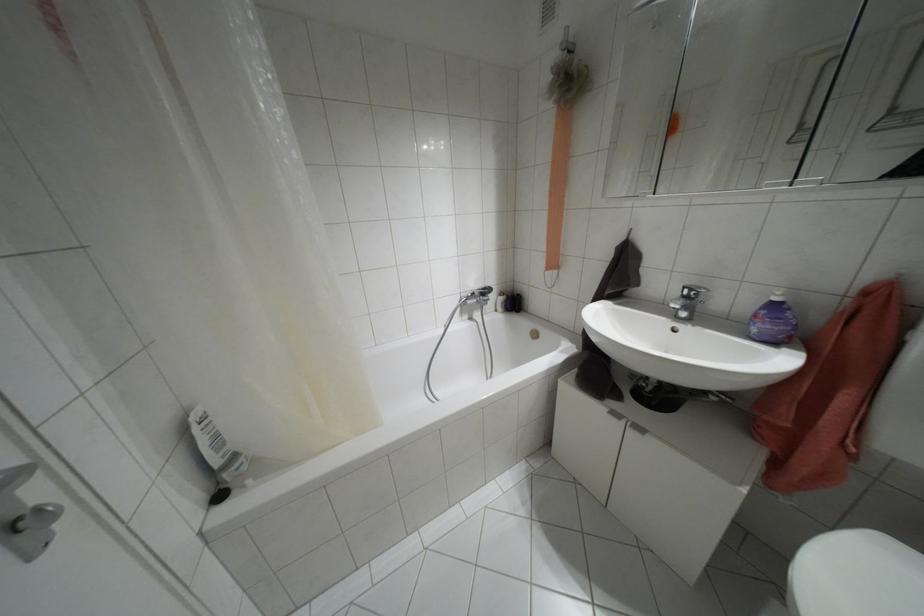
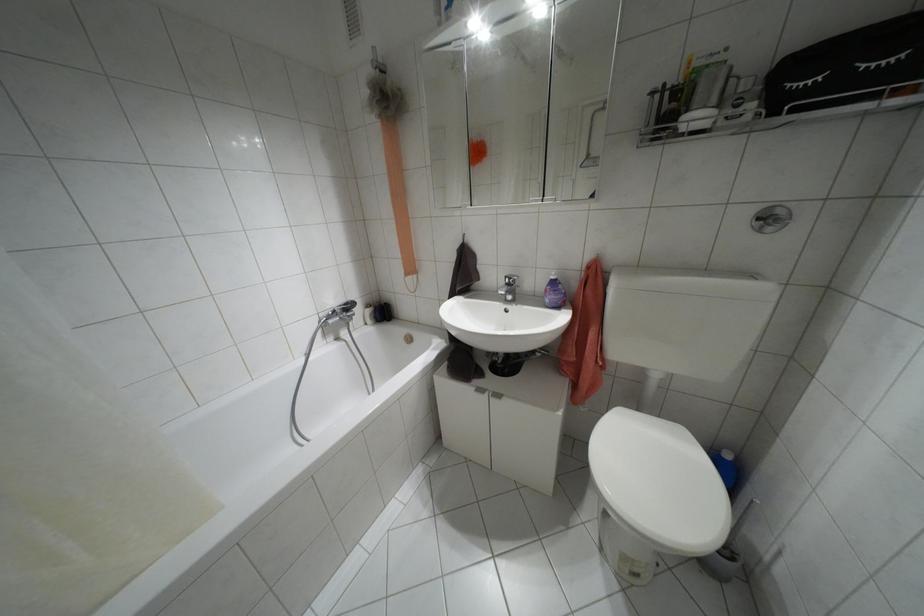
Where in the second image is the point corresponding to pixel 686 297 from the first image?

(507, 284)